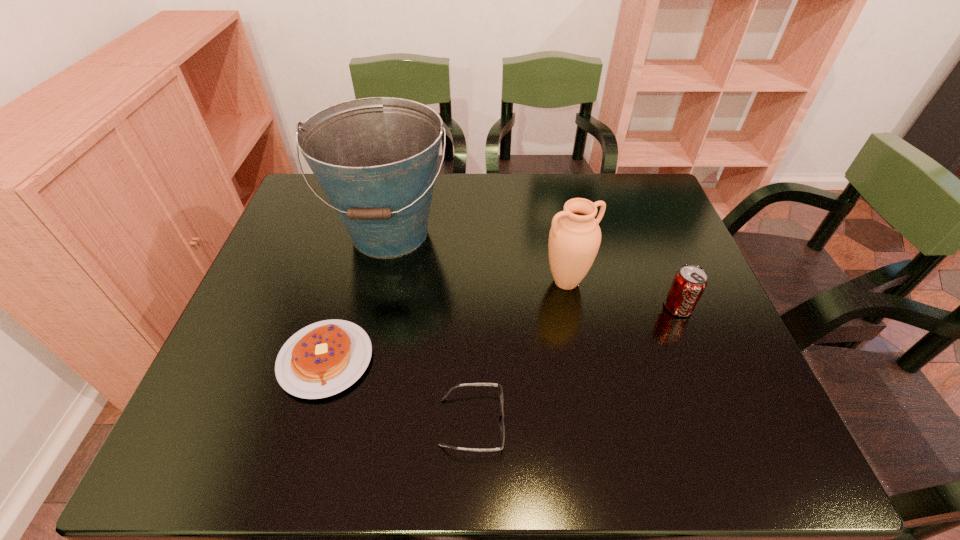
The width and height of the screenshot is (960, 540). I want to click on free region located 0.240m on the front of the pop soda, so click(x=721, y=413).

The image size is (960, 540). In order to click on vacant space located 0.180m on the right of the pancake in this screenshot , I will do `click(454, 359)`.

Identify the location of free region located on the front-facing side of the shortest object. (641, 422).

Locate an element on the screen. The width and height of the screenshot is (960, 540). object at the far edge is located at coordinates (376, 158).

Where is `object that is positioned at the near edge`? object that is positioned at the near edge is located at coordinates [x=502, y=427].

You are a GUI agent. You are given a task and a screenshot of the screen. Output one action in this format:
    pyautogui.click(x=<x>, y=<y>)
    Task: Click on the bucket situated at the left edge
    Image resolution: width=960 pixels, height=540 pixels.
    Given the screenshot: What is the action you would take?
    pyautogui.click(x=376, y=158)

Identify the location of pancake positioned at the left edge. This screenshot has width=960, height=540. (322, 359).

Locate an element on the screen. object located at the right edge is located at coordinates (689, 283).

What are the coordinates of `object located at the far left corner` in the screenshot? It's located at point(376,158).

This screenshot has height=540, width=960. In order to click on vacant space at the far edge of the desktop in this screenshot , I will do `click(547, 188)`.